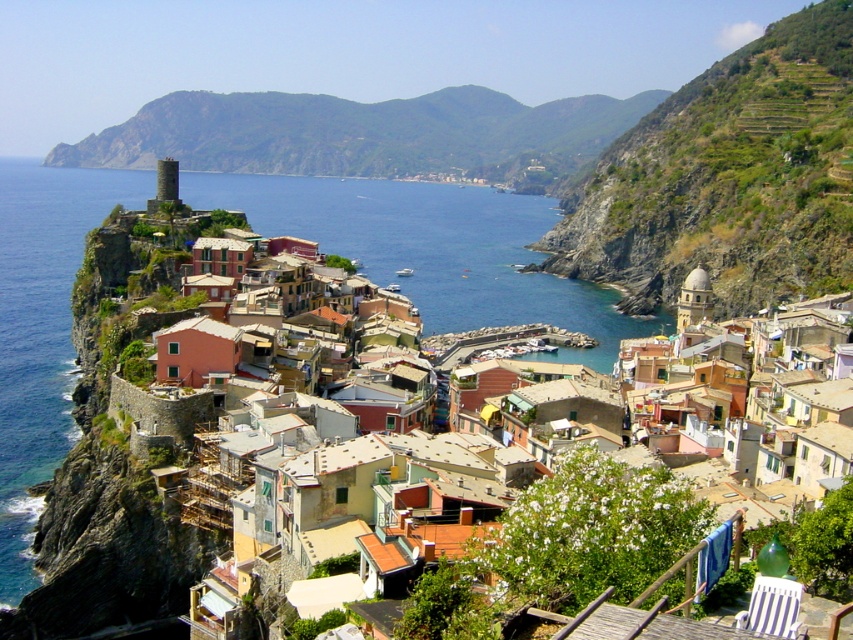
Question: Is green grassy hillside at upper center to the left of blue water at center from the viewer's perspective?

Choices:
 (A) no
 (B) yes

Answer: (B)

Question: Can you confirm if green grassy hillside at upper right is positioned above blue water at center?

Choices:
 (A) yes
 (B) no

Answer: (A)

Question: Estimate the real-world distances between objects in this image. Which object is farther from the green grassy hillside at upper center?

Choices:
 (A) blue water at center
 (B) green grassy hillside at upper right

Answer: (B)

Question: Considering the real-world distances, which object is farthest from the green grassy hillside at upper center?

Choices:
 (A) green grassy hillside at upper right
 (B) blue water at center

Answer: (A)

Question: Does green grassy hillside at upper right appear on the left side of blue water at center?

Choices:
 (A) yes
 (B) no

Answer: (B)

Question: Which point is farther from the camera taking this photo?

Choices:
 (A) (483, 218)
 (B) (677, 212)

Answer: (A)